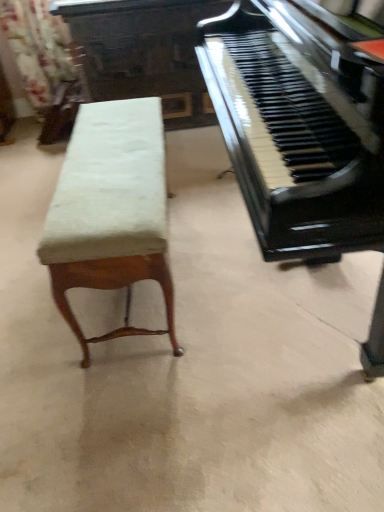
Locate an element on the screen. The image size is (384, 512). blank space situated above velvet upholstered bench at left (from a real-world perspective) is located at coordinates (105, 158).